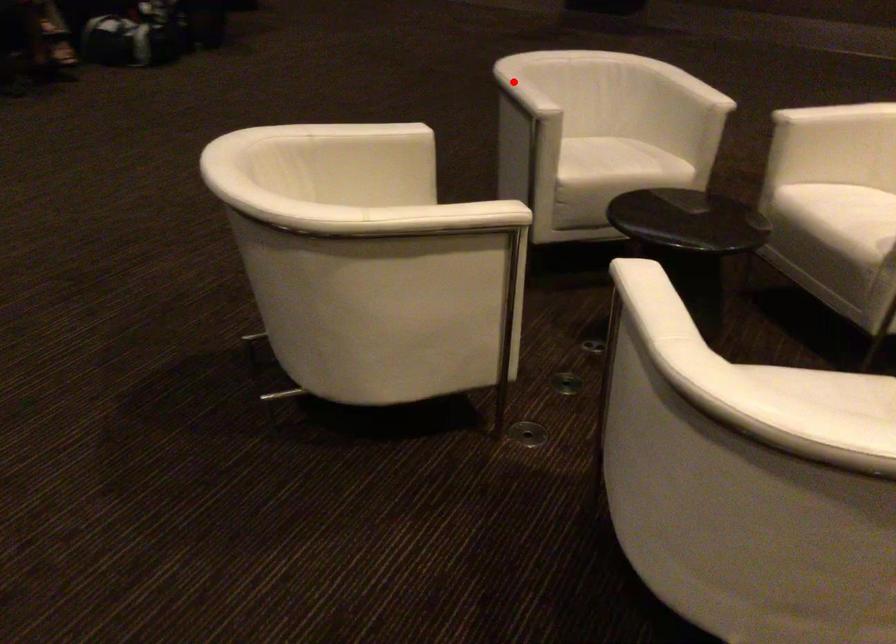
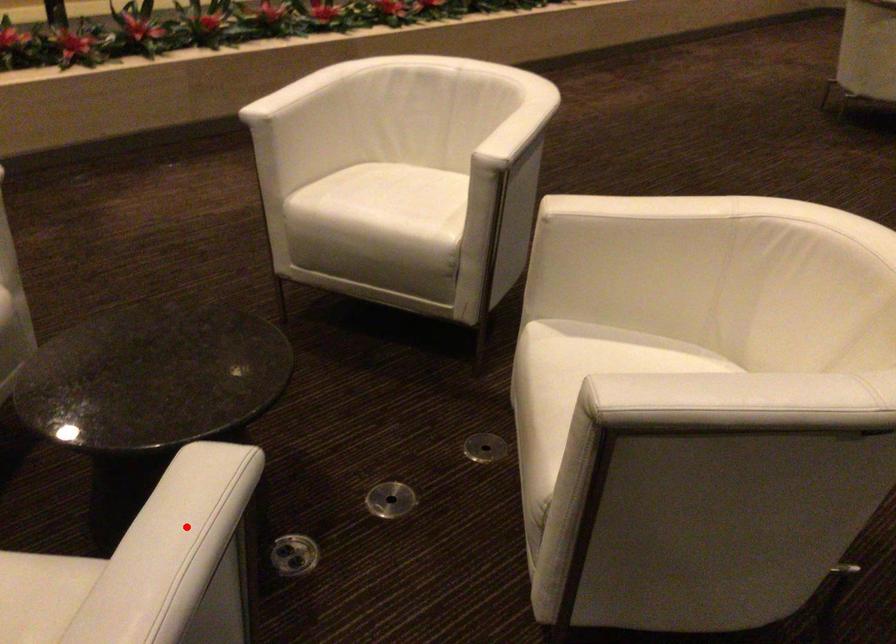
I am providing you with two images of the same scene from different viewpoints. A red point is marked on the first image and another point is marked on the second image. Do the highlighted points in image1 and image2 indicate the same real-world spot?

Yes